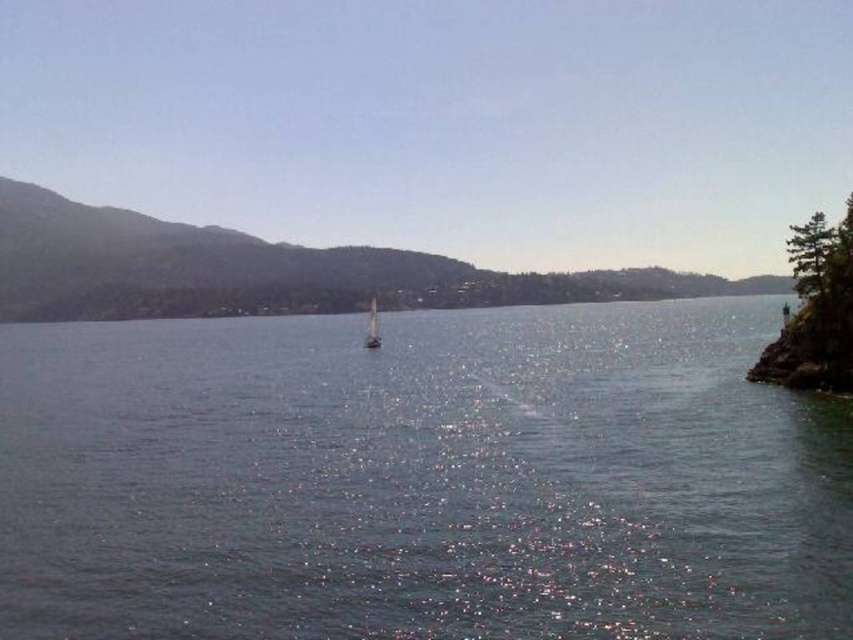
You are a sailor who wants to anchor your boat safely. Based on the scene, where should you position your anchor so that it stays in the clear water at center without getting tangled in the white glossy sailboat at center?

The clear water at center is positioned under the white glossy sailboat at center, so anchoring directly beneath the boat would keep the anchor in the clear water at center while avoiding entanglement with the boat.

You are an observer standing on the shore of the lake. You see the clear water at center and the white glossy sailboat at center. Which one takes up more space in the image?

The clear water at center is bigger than the white glossy sailboat at center, so it takes up more space in the image.